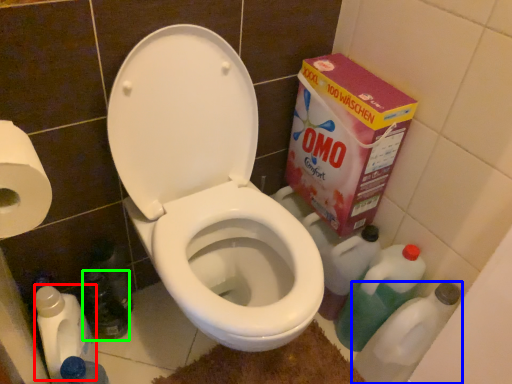
Question: Estimate the real-world distances between objects in this image. Which object is farther from cleaning product (highlighted by a red box), cleaning product (highlighted by a blue box) or bottle (highlighted by a green box)?

Choices:
 (A) cleaning product
 (B) bottle

Answer: (A)